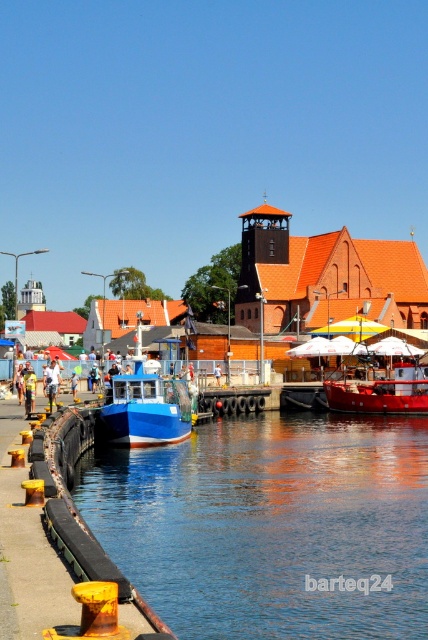
You are a photographer standing at the waterfront. You notice a yellow reflective vest at center and a white fabric umbrella at upper center. Which object is positioned higher in the image?

The white fabric umbrella at upper center is positioned higher in the image than the yellow reflective vest at center.

You are a photographer trying to capture both the yellow reflective vest at center and the white fabric umbrella at upper center in a single shot. Given their sizes, which object should you focus on to ensure both are clearly visible in the frame?

The yellow reflective vest at center is larger in size than the white fabric umbrella at upper center, so focusing on the yellow reflective vest at center would help ensure both objects are clearly visible in the frame since it occupies more space and can be positioned to balance the composition with the smaller white fabric umbrella at upper center.